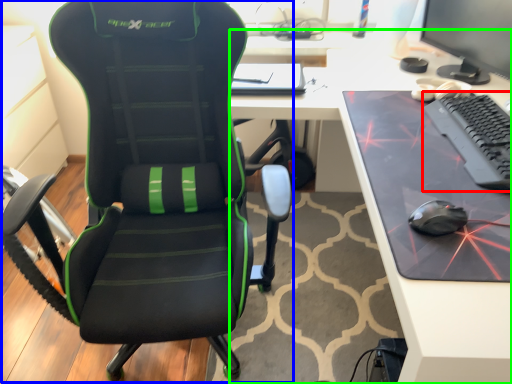
Question: Considering the real-world distances, which object is farthest from computer keyboard (highlighted by a red box)? chair (highlighted by a blue box) or desk (highlighted by a green box)?

Choices:
 (A) chair
 (B) desk

Answer: (A)